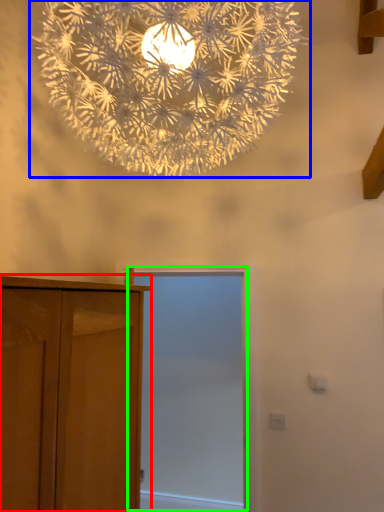
Question: Considering the real-world distances, which object is closest to cupboard (highlighted by a red box)? lamp (highlighted by a blue box) or screen door (highlighted by a green box).

Choices:
 (A) lamp
 (B) screen door

Answer: (A)